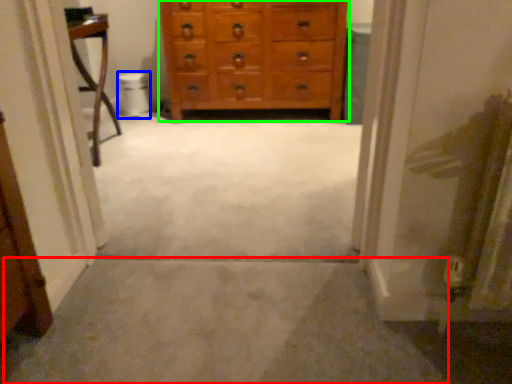
Question: Based on their relative distances, which object is nearer to path (highlighted by a red box)? Choose from toilet bowl (highlighted by a blue box) and chest of drawers (highlighted by a green box).

Choices:
 (A) toilet bowl
 (B) chest of drawers

Answer: (B)